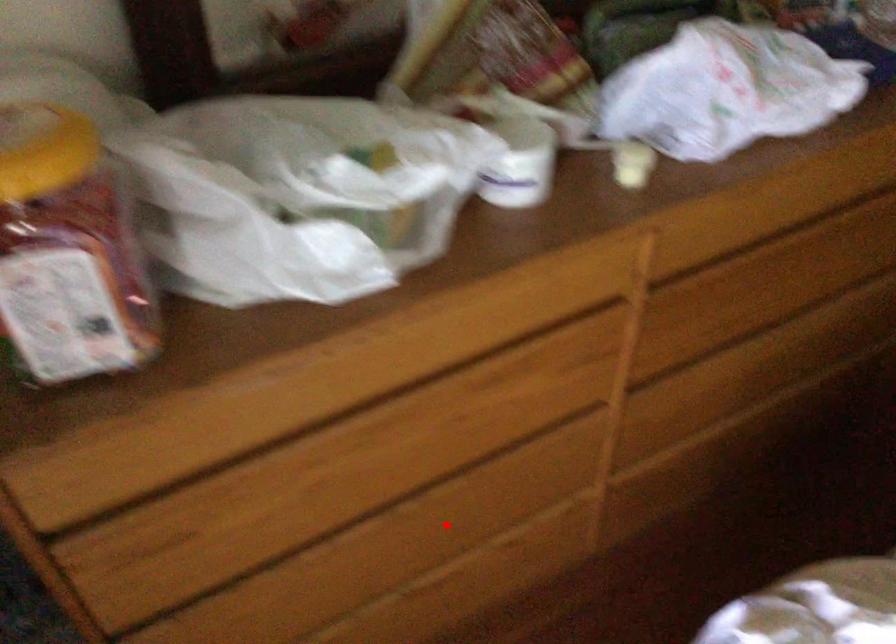
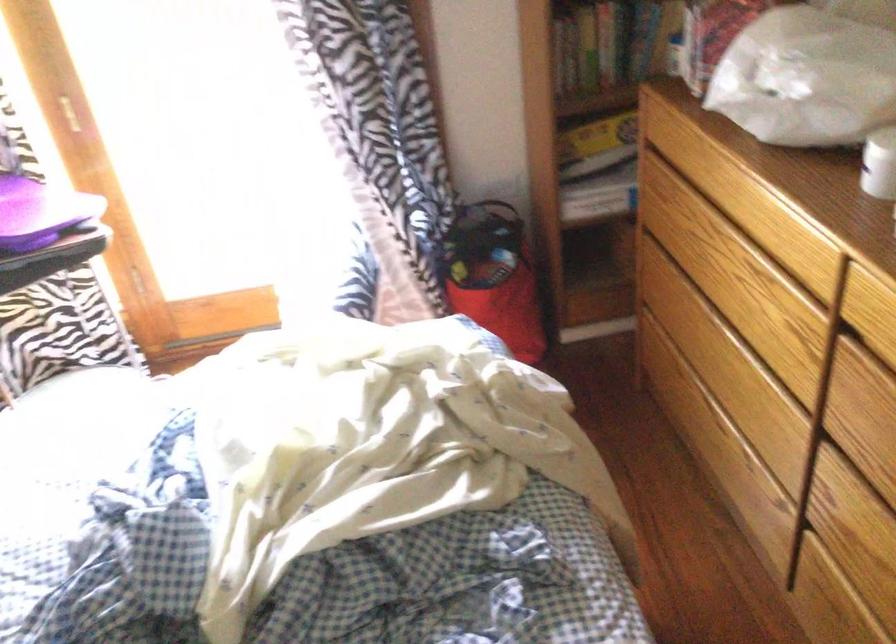
Question: I am providing you with two images of the same scene from different viewpoints. A red point is shown in image1. For the corresponding object point in image2, is it positioned nearer or farther from the camera?

Choices:
 (A) Nearer
 (B) Farther

Answer: (B)